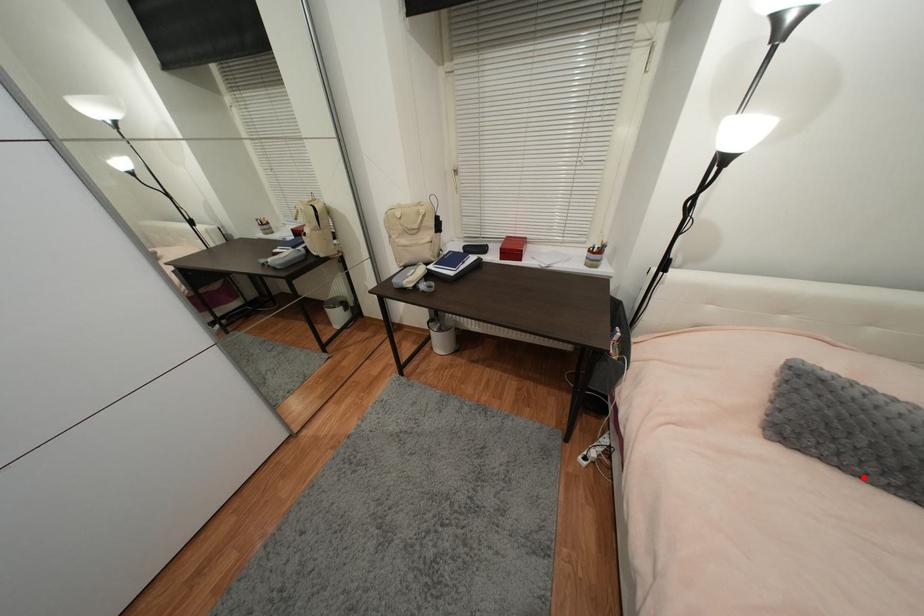
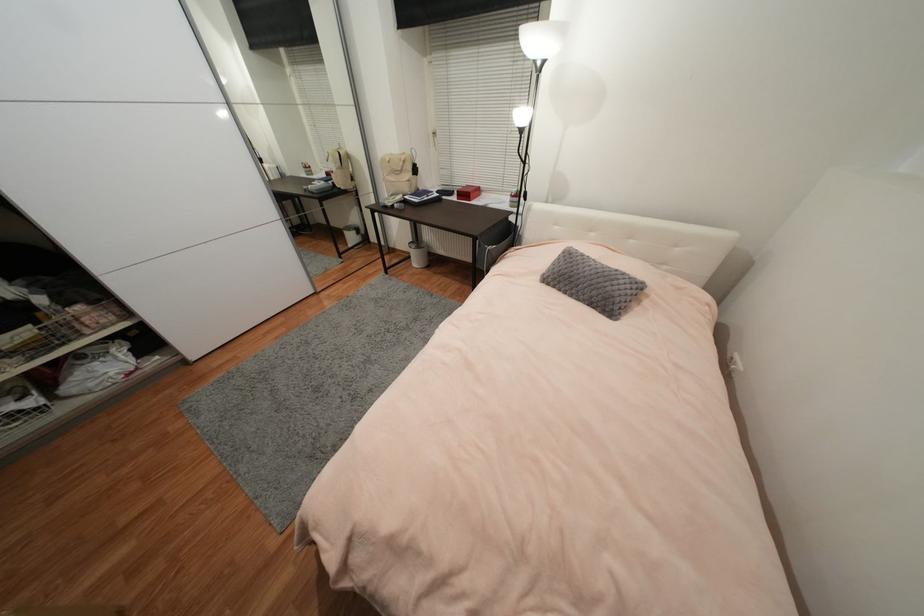
Where in the second image is the point corresponding to the highlighted location from the first image?

(569, 294)